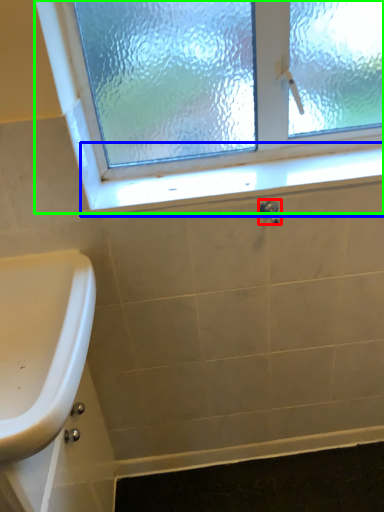
Question: Which is farther away from plumbing fixture (highlighted by a red box)? window sill (highlighted by a blue box) or window (highlighted by a green box)?

Choices:
 (A) window sill
 (B) window

Answer: (B)